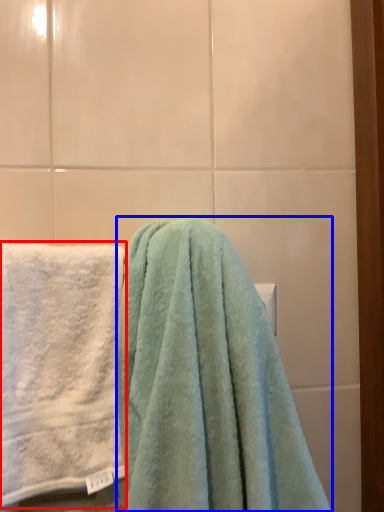
Question: Which object is closer to the camera taking this photo, towel (highlighted by a red box) or towel (highlighted by a blue box)?

Choices:
 (A) towel
 (B) towel

Answer: (B)